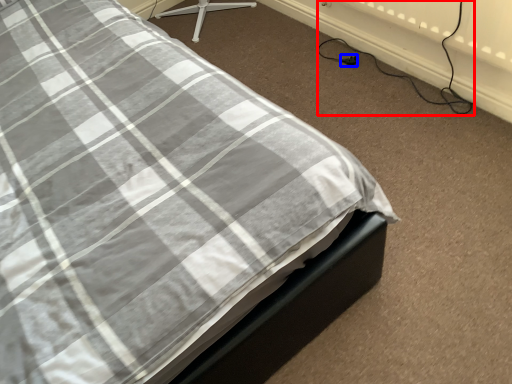
Question: Which of the following is the closest to the observer, cable (highlighted by a red box) or plug (highlighted by a blue box)?

Choices:
 (A) cable
 (B) plug

Answer: (A)